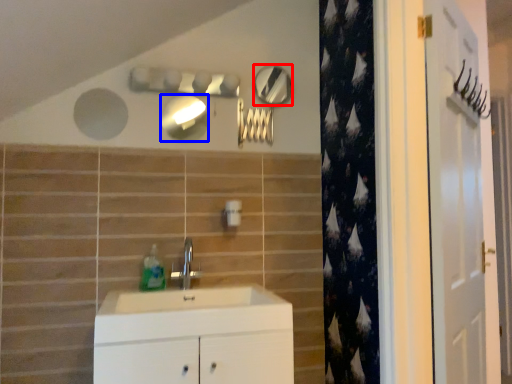
Question: Which of the following is the closest to the observer, mirror (highlighted by a red box) or mirror (highlighted by a blue box)?

Choices:
 (A) mirror
 (B) mirror

Answer: (B)